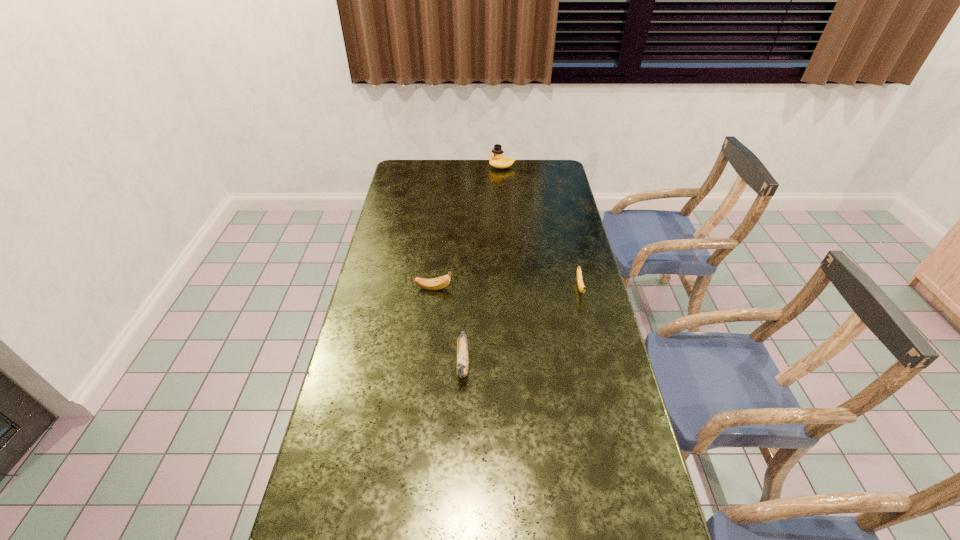
Locate an element on the screen. This screenshot has height=540, width=960. the tallest object is located at coordinates (498, 160).

I want to click on the third object from left to right, so click(498, 160).

I want to click on the tallest banana, so click(x=462, y=347).

At what (x,y) coordinates should I click in order to perform the action: click on the nearest object. Please return your answer as a coordinate pair (x, y). Image resolution: width=960 pixels, height=540 pixels. Looking at the image, I should click on (462, 347).

Identify the location of the second shortest object. (441, 282).

You are a GUI agent. You are given a task and a screenshot of the screen. Output one action in this format:
    pyautogui.click(x=<x>, y=<y>)
    Task: Click on the leftmost object
    The height and width of the screenshot is (540, 960).
    Given the screenshot: What is the action you would take?
    pyautogui.click(x=441, y=282)

Locate an element on the screen. the shortest banana is located at coordinates (581, 287).

Identify the location of the shortest object. (581, 287).

Where is `free space located on the front-facing side of the tallest object`? free space located on the front-facing side of the tallest object is located at coordinates (453, 167).

Where is `free location located 0.310m on the front-facing side of the tallest object`? free location located 0.310m on the front-facing side of the tallest object is located at coordinates (424, 167).